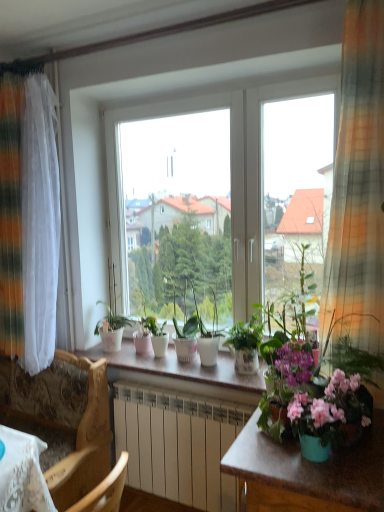
Describe the element at coordinates (307, 473) in the screenshot. I see `matte brown table at lower right` at that location.

The image size is (384, 512). Describe the element at coordinates (186, 338) in the screenshot. I see `matte white pot at center, which appears as the 3th houseplant when viewed from the left` at that location.

In order to click on white glossy pot at center, the second houseplant from the right in this screenshot , I will do `click(246, 345)`.

What do you see at coordinates (157, 335) in the screenshot? The height and width of the screenshot is (512, 384). I see `matte white pot at center, the 5th houseplant when ordered from right to left` at bounding box center [157, 335].

This screenshot has width=384, height=512. What do you see at coordinates (181, 367) in the screenshot?
I see `white glossy counter top at center` at bounding box center [181, 367].

I want to click on matte brown table at lower right, so [307, 473].

Which object is thinner, white glossy pot at center, the 4th houseplant when ordered from left to right, or matte brown table at lower right?

white glossy pot at center, the 4th houseplant when ordered from left to right, is thinner.

Is white glossy pot at center, the 4th houseplant when ordered from left to right, in contact with matte brown table at lower right?

white glossy pot at center, the 4th houseplant when ordered from left to right, and matte brown table at lower right are clearly separated.

From the image's perspective, which one is positioned lower, white glossy pot at center, arranged as the third houseplant when viewed from the right, or matte brown table at lower right?

matte brown table at lower right appears lower in the image.

Is white glossy pot at center, the 4th houseplant when ordered from left to right, to the left of matte brown table at lower right from the viewer's perspective?

Yes.

Considering the positions of objects white glossy pot at center, acting as the sixth houseplant starting from the right, and white glossy pot at center, the 4th houseplant when ordered from left to right, in the image provided, who is more to the right, white glossy pot at center, acting as the sixth houseplant starting from the right, or white glossy pot at center, the 4th houseplant when ordered from left to right,?

white glossy pot at center, the 4th houseplant when ordered from left to right.

Is white glossy pot at center, acting as the sixth houseplant starting from the right, facing away from white glossy pot at center, arranged as the third houseplant when viewed from the right?

That's not correct — white glossy pot at center, acting as the sixth houseplant starting from the right, is not looking away from white glossy pot at center, arranged as the third houseplant when viewed from the right.

Which object is wider, white glossy pot at center, acting as the sixth houseplant starting from the right, or white glossy pot at center, arranged as the third houseplant when viewed from the right?

With larger width is white glossy pot at center, acting as the sixth houseplant starting from the right.

Based on the photo, is white glossy pot at center, the 4th houseplant when ordered from left to right, a part of white glossy pot at center, acting as the sixth houseplant starting from the right?

No, white glossy pot at center, the 4th houseplant when ordered from left to right, is not a part of white glossy pot at center, acting as the sixth houseplant starting from the right.

Which is behind, point (268, 489) or point (102, 341)?

The point (102, 341) is behind.

Is matte brown table at lower right at the right side of white glossy pot at center, acting as the sixth houseplant starting from the right?

Correct, you'll find matte brown table at lower right to the right of white glossy pot at center, acting as the sixth houseplant starting from the right.

From the image's perspective, between matte brown table at lower right and white glossy pot at center, acting as the sixth houseplant starting from the right, who is located below?

matte brown table at lower right is shown below in the image.

You are a GUI agent. You are given a task and a screenshot of the screen. Output one action in this format:
    pyautogui.click(x=<x>, y=<y>)
    Task: Click on the houseplant on the right of white glossy pot at center, which is counted as the 5th houseplant, starting from the left
    
    Given the screenshot: What is the action you would take?
    pyautogui.click(x=289, y=341)

Does green glossy plant at center, which ranks as the sixth houseplant in left-to-right order, have a larger size compared to white glossy pot at center, which is counted as the 5th houseplant, starting from the left?

Yes.

Is green glossy plant at center, which ranks as the sixth houseplant in left-to-right order, in front of or behind white glossy pot at center, which is counted as the 5th houseplant, starting from the left, in the image?

green glossy plant at center, which ranks as the sixth houseplant in left-to-right order, is in front of white glossy pot at center, which is counted as the 5th houseplant, starting from the left.

Considering the points (302, 254) and (256, 351), which point is in front, point (302, 254) or point (256, 351)?

Point (256, 351)

Measure the distance from matte white pot at center, the 5th houseplant when ordered from right to left, to white glossy pot at center, arranged as the third houseplant when viewed from the right.

The distance of matte white pot at center, the 5th houseplant when ordered from right to left, from white glossy pot at center, arranged as the third houseplant when viewed from the right, is 9.87 inches.

Between matte white pot at center, the 5th houseplant when ordered from right to left, and white glossy pot at center, the 4th houseplant when ordered from left to right, which one has more height?

With more height is white glossy pot at center, the 4th houseplant when ordered from left to right.

Is there a large distance between matte white pot at center, the 5th houseplant when ordered from right to left, and white glossy pot at center, arranged as the third houseplant when viewed from the right?

They are positioned close to each other.

What are the coordinates of `the 2nd houseplant located above the matte white pot at center, the 5th houseplant when ordered from right to left (from a real-world perspective)` in the screenshot? It's located at (207, 336).

From the image's perspective, who appears lower, green glossy plant at center, which ranks as the sixth houseplant in left-to-right order, or matte brown table at lower right?

matte brown table at lower right.

Which is more to the left, green glossy plant at center, which ranks as the sixth houseplant in left-to-right order, or matte brown table at lower right?

green glossy plant at center, which ranks as the sixth houseplant in left-to-right order.

Would you say green glossy plant at center, which ranks as the sixth houseplant in left-to-right order, is inside or outside matte brown table at lower right?

green glossy plant at center, which ranks as the sixth houseplant in left-to-right order, is spatially situated outside matte brown table at lower right.

Based on their sizes in the image, would you say green glossy plant at center, which ranks as the sixth houseplant in left-to-right order, is bigger or smaller than matte brown table at lower right?

Clearly, green glossy plant at center, which ranks as the sixth houseplant in left-to-right order, is smaller in size than matte brown table at lower right.

Consider the image. Considering the sizes of objects matte white pot at center, which appears as the 3th houseplant when viewed from the left, and green glossy plant at center, which ranks as the sixth houseplant in left-to-right order, in the image provided, who is smaller, matte white pot at center, which appears as the 3th houseplant when viewed from the left, or green glossy plant at center, which ranks as the sixth houseplant in left-to-right order,?

Smaller between the two is matte white pot at center, which appears as the 3th houseplant when viewed from the left.

Could you measure the distance between matte white pot at center, which appears as the 3th houseplant when viewed from the left, and green glossy plant at center, placed as the 1th houseplant when sorted from right to left?

A distance of 22.19 inches exists between matte white pot at center, which appears as the 3th houseplant when viewed from the left, and green glossy plant at center, placed as the 1th houseplant when sorted from right to left.

Can you confirm if matte white pot at center, positioned as the 4th houseplant in right-to-left order, is positioned to the left of green glossy plant at center, placed as the 1th houseplant when sorted from right to left?

Yes.

From the image's perspective, relative to green glossy plant at center, placed as the 1th houseplant when sorted from right to left, is matte white pot at center, positioned as the 4th houseplant in right-to-left order, above or below?

matte white pot at center, positioned as the 4th houseplant in right-to-left order, is below green glossy plant at center, placed as the 1th houseplant when sorted from right to left.

From the image's perspective, starting from the matte brown table at lower right, which houseplant is the 3rd one above? Please provide its 2D coordinates.

[(207, 336)]

From the white glossy pot at center, the 4th houseplant when ordered from left to right, count 3rd houseplants backward and point to it. Please provide its 2D coordinates.

[(112, 321)]

Considering their positions, is matte brown table at lower right positioned closer to matte white pot at center, the 2th houseplant from the left, than white glossy pot at center, the second houseplant from the right?

The object closer to matte white pot at center, the 2th houseplant from the left, is white glossy pot at center, the second houseplant from the right.

Considering their positions, is white glossy pot at center, the first houseplant when ordered from left to right, positioned closer to matte white pot at center, which appears as the 3th houseplant when viewed from the left, than white glossy counter top at center?

white glossy counter top at center is closer to matte white pot at center, which appears as the 3th houseplant when viewed from the left.

Considering their positions, is matte brown table at lower right positioned further to white glossy pot at center, acting as the sixth houseplant starting from the right, than green glossy plant at center, placed as the 1th houseplant when sorted from right to left?

matte brown table at lower right.

Based on their spatial positions, is matte brown table at lower right or white glossy pot at center, acting as the sixth houseplant starting from the right, further from green glossy plant at center, placed as the 1th houseplant when sorted from right to left?

The object further to green glossy plant at center, placed as the 1th houseplant when sorted from right to left, is white glossy pot at center, acting as the sixth houseplant starting from the right.

When comparing their distances from white glossy pot at center, the first houseplant when ordered from left to right, does matte white pot at center, the 2th houseplant from the left, or matte white pot at center, which appears as the 3th houseplant when viewed from the left, seem further?

matte white pot at center, which appears as the 3th houseplant when viewed from the left, lies further to white glossy pot at center, the first houseplant when ordered from left to right, than the other object.

Which object lies further to the anchor point green glossy plant at center, placed as the 1th houseplant when sorted from right to left, white glossy pot at center, the 4th houseplant when ordered from left to right, or white glossy pot at center, the second houseplant from the right?

The object further to green glossy plant at center, placed as the 1th houseplant when sorted from right to left, is white glossy pot at center, the 4th houseplant when ordered from left to right.

From the image, which object appears to be farther from white glossy counter top at center, matte white pot at center, positioned as the 4th houseplant in right-to-left order, or matte white pot at center, the 5th houseplant when ordered from right to left?

Among the two, matte white pot at center, the 5th houseplant when ordered from right to left, is located further to white glossy counter top at center.

From the image, which object appears to be nearer to matte brown table at lower right, matte white pot at center, the 5th houseplant when ordered from right to left, or white glossy pot at center, which is counted as the 5th houseplant, starting from the left?

The object closer to matte brown table at lower right is white glossy pot at center, which is counted as the 5th houseplant, starting from the left.

Where is `counter top between green glossy plant at center, which ranks as the sixth houseplant in left-to-right order, and matte white pot at center, which appears as the 3th houseplant when viewed from the left, in the front-back direction`? This screenshot has height=512, width=384. counter top between green glossy plant at center, which ranks as the sixth houseplant in left-to-right order, and matte white pot at center, which appears as the 3th houseplant when viewed from the left, in the front-back direction is located at coordinates (181, 367).

Locate an element on the screen. houseplant located between matte white pot at center, positioned as the 4th houseplant in right-to-left order, and white glossy pot at center, which is counted as the 5th houseplant, starting from the left, in the left-right direction is located at coordinates (207, 336).

Where is `counter top between green glossy plant at center, which ranks as the sixth houseplant in left-to-right order, and matte white pot at center, the 5th houseplant when ordered from right to left, along the z-axis`? The height and width of the screenshot is (512, 384). counter top between green glossy plant at center, which ranks as the sixth houseplant in left-to-right order, and matte white pot at center, the 5th houseplant when ordered from right to left, along the z-axis is located at coordinates (181, 367).

Where is `houseplant located between matte white pot at center, the 2th houseplant from the left, and white glossy pot at center, arranged as the third houseplant when viewed from the right, in the left-right direction`? Image resolution: width=384 pixels, height=512 pixels. houseplant located between matte white pot at center, the 2th houseplant from the left, and white glossy pot at center, arranged as the third houseplant when viewed from the right, in the left-right direction is located at coordinates (186, 338).